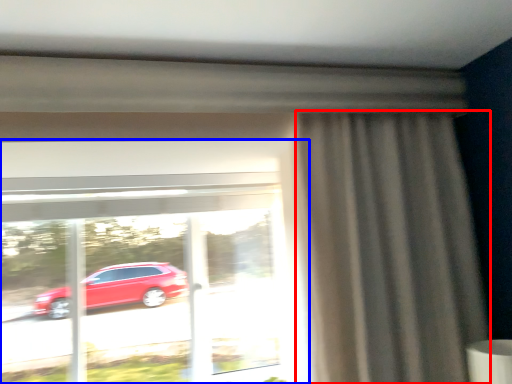
Question: Which point is further to the camera, curtain (highlighted by a red box) or window (highlighted by a blue box)?

Choices:
 (A) curtain
 (B) window

Answer: (B)